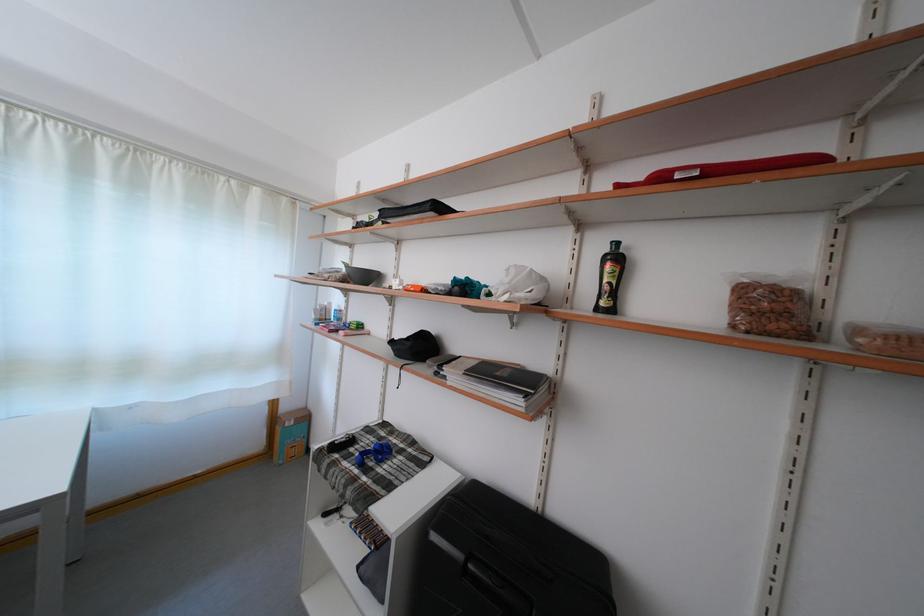
Identify the location of blue strap. The image size is (924, 616). (373, 453).